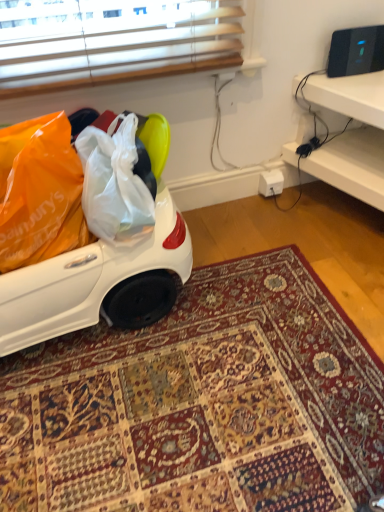
Where is `free spot below white plastic desk at right (from a real-world perspective)`? The height and width of the screenshot is (512, 384). free spot below white plastic desk at right (from a real-world perspective) is located at coordinates (341, 219).